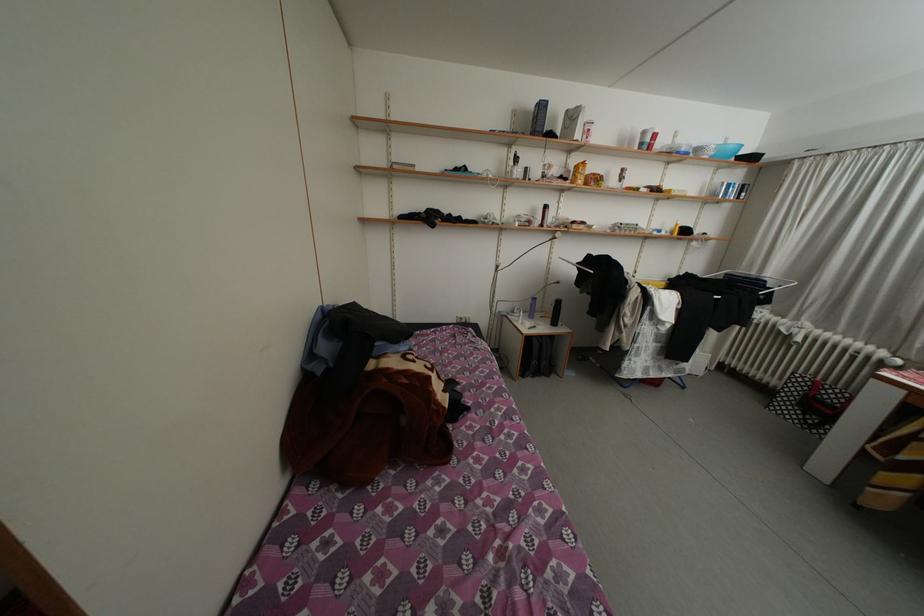
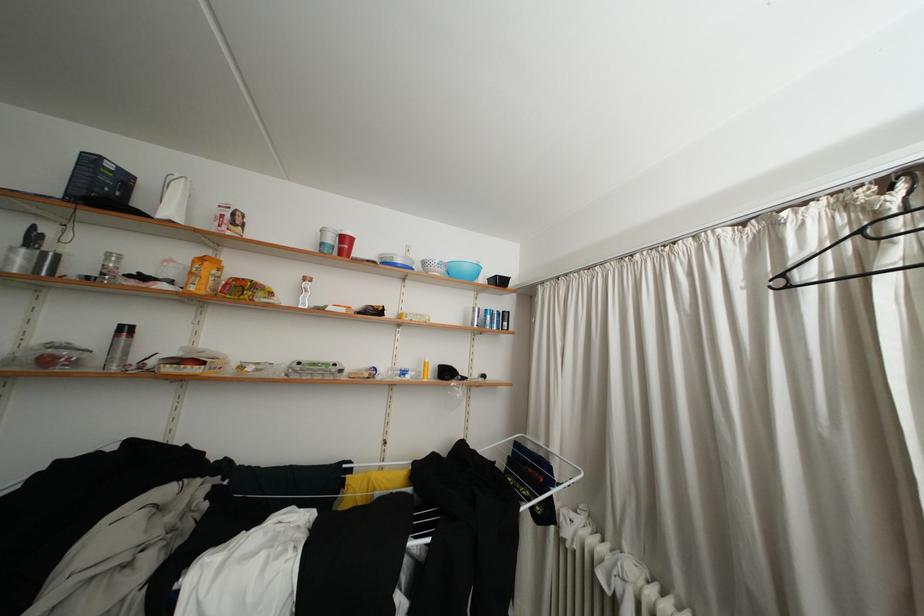
Find the pixel in the second image that matches [657,144] in the first image.

(338, 245)